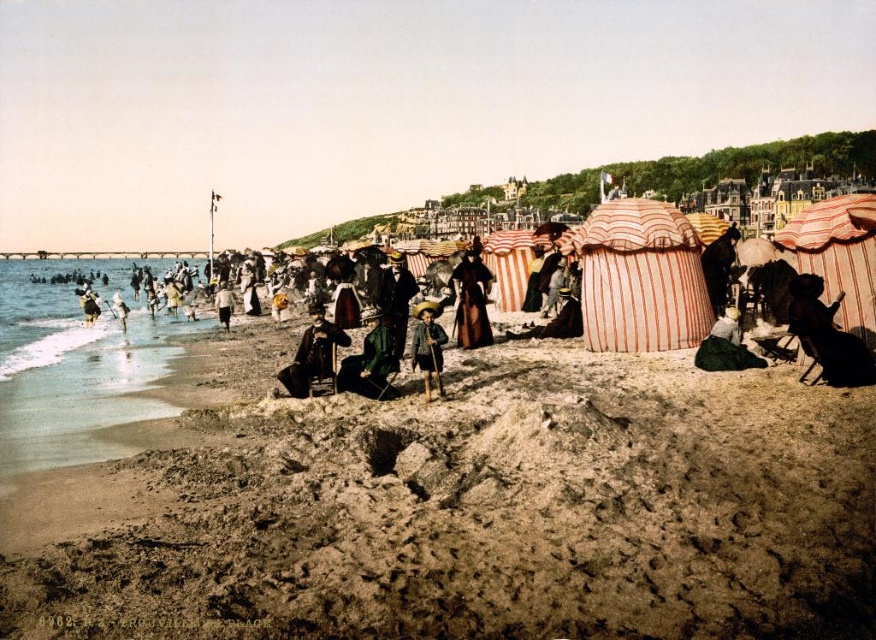
Question: Can you confirm if wooden stick at center is positioned above white cotton dress at lower left?

Choices:
 (A) yes
 (B) no

Answer: (B)

Question: Can you confirm if green velvet dress at lower right is bigger than wooden stick at center?

Choices:
 (A) yes
 (B) no

Answer: (A)

Question: Which point appears farthest from the camera in this image?

Choices:
 (A) (870, 368)
 (B) (432, 304)
 (C) (387, 554)
 (D) (299, 358)

Answer: (B)

Question: Which object appears farthest from the camera in this image?

Choices:
 (A) brown leather coat at center
 (B) brown sandy beach at lower center

Answer: (A)

Question: Is the position of dark brown velvet coat at center less distant than that of brown leather coat at center?

Choices:
 (A) yes
 (B) no

Answer: (A)

Question: Which of the following is the closest to the observer?

Choices:
 (A) brown leather coat at center
 (B) brown sandy beach at lower center

Answer: (B)